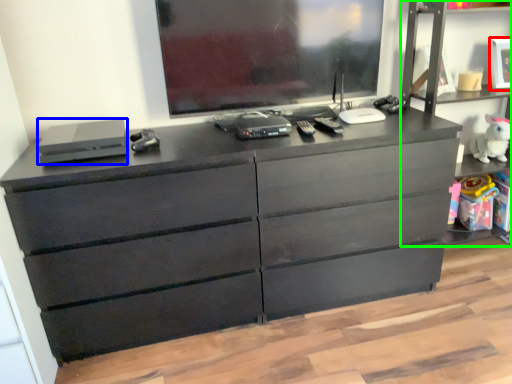
Question: Estimate the real-world distances between objects in this image. Which object is farther from picture frame (highlighted by a red box), equipment (highlighted by a blue box) or tv cabinet (highlighted by a green box)?

Choices:
 (A) equipment
 (B) tv cabinet

Answer: (A)